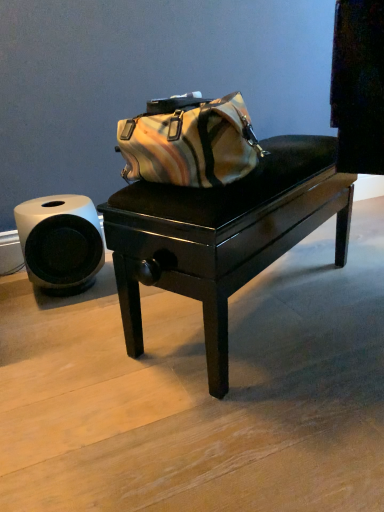
Identify the location of vacant region below glossy black table at center (from a real-world perspective). This screenshot has height=512, width=384. [259, 304].